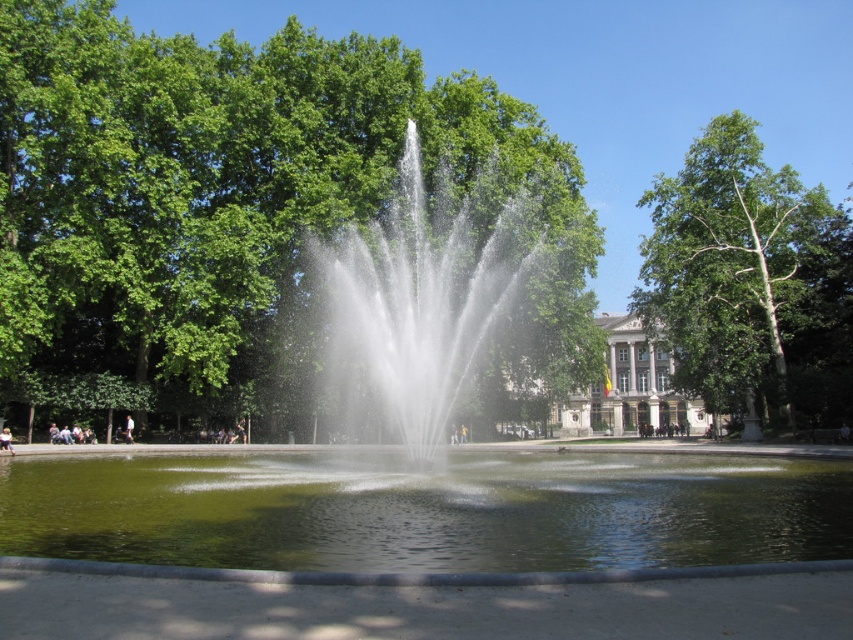
Does green liquid water at center have a lesser height compared to light blue denim shorts at center?

In fact, green liquid water at center may be taller than light blue denim shorts at center.

Is green liquid water at center taller than light blue denim shorts at center?

Yes, green liquid water at center is taller than light blue denim shorts at center.

Between point (318, 483) and point (3, 428), which one is positioned behind?

Positioned behind is point (3, 428).

Where is `green liquid water at center`? The height and width of the screenshot is (640, 853). green liquid water at center is located at coordinates (427, 509).

Does green leafy tree at center appear over green liquid water at center?

Indeed, green leafy tree at center is positioned over green liquid water at center.

Can you confirm if green leafy tree at center is positioned below green liquid water at center?

Incorrect, green leafy tree at center is not positioned below green liquid water at center.

Image resolution: width=853 pixels, height=640 pixels. What are the coordinates of `green leafy tree at center` in the screenshot? It's located at (238, 195).

Where is `green leafy tree at center`? green leafy tree at center is located at coordinates (238, 195).

Between point (344, 77) and point (444, 410), which one is positioned behind?

Point (344, 77)

Does green leafy tree at center appear on the right side of clear water fountain at center?

In fact, green leafy tree at center is to the left of clear water fountain at center.

At what (x,y) coordinates should I click in order to perform the action: click on green leafy tree at center. Please return your answer as a coordinate pair (x, y). The width and height of the screenshot is (853, 640). Looking at the image, I should click on (238, 195).